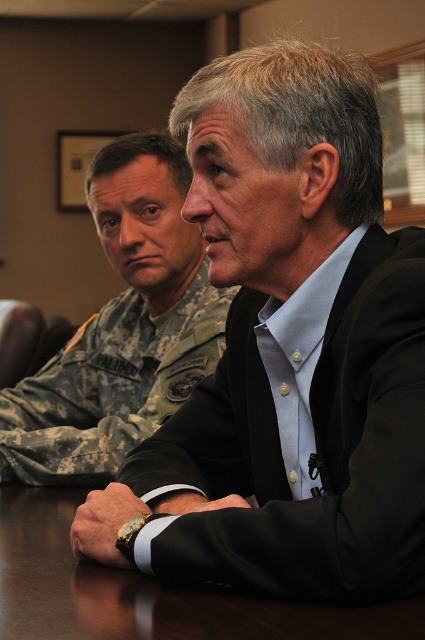
You are a delivery robot with a 20 inch wide package. You need to place the package between the camouflage uniform at left and the dark brown wood table at center. Is there enough space between them to fit the package?

The camouflage uniform at left and dark brown wood table at center are 19.86 inches apart from each other, so there is not enough space to fit a 20 inch wide package between them.

You are a photographer setting up for a formal portrait. You have a black matte suit at center and a dark brown wood table at center in your frame. Which object should you adjust to ensure proper alignment with the camera? Explain your reasoning.

The black matte suit at center is to the right of the dark brown wood table at center, so you should adjust the position of the black matte suit at center to align it correctly with the table and the camera frame.